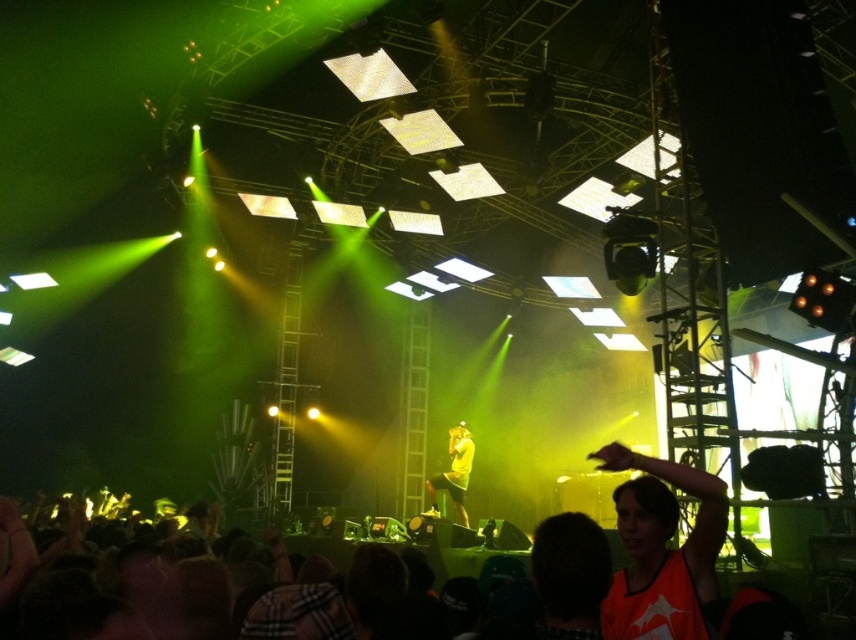
You are a photographer at the concert and need to capture a closeup shot of both the orange jersey at lower right and the yellow matte shirt at center. Given their sizes, which one might require you to step back to frame properly?

The orange jersey at lower right has a larger width than the yellow matte shirt at center, so to capture both in frame, you might need to step back to accommodate the wider orange jersey at lower right.

You are attending a concert and notice two performers on stage. One is wearing an orange jersey at lower right and the other a yellow matte shirt at center. From your seat in the audience, which performer appears taller?

The yellow matte shirt at center appears taller because the orange jersey at lower right has a lesser height compared to it.